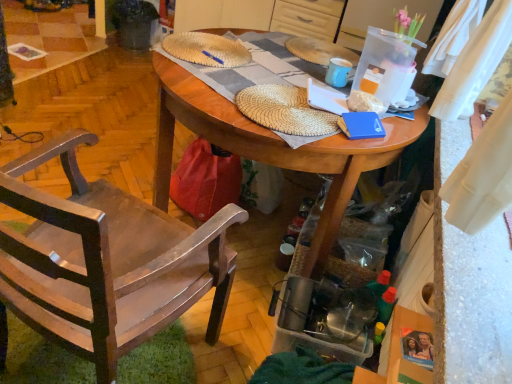
Where is `vacant space positioned to the left of woven straw hat at center, the first hat when ordered from front to back`? vacant space positioned to the left of woven straw hat at center, the first hat when ordered from front to back is located at coordinates (207, 71).